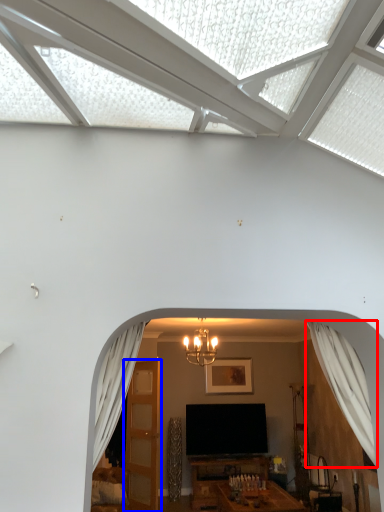
Question: Which of the following is the closest to the observer, curtain (highlighted by a red box) or door (highlighted by a blue box)?

Choices:
 (A) curtain
 (B) door

Answer: (A)